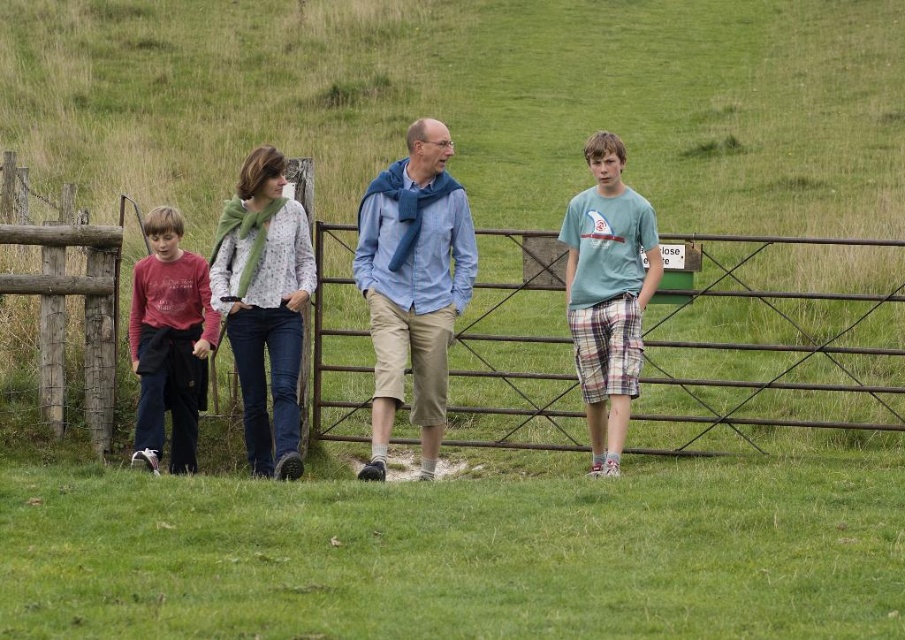
Can you confirm if light blue t-shirt at center is taller than matte red shirt at left?

Yes.

Does point (615, 179) lie behind point (181, 369)?

Yes, point (615, 179) is behind point (181, 369).

Between point (593, 317) and point (154, 218), which one is positioned behind?

Point (154, 218)

This screenshot has height=640, width=905. Find the location of `light blue t-shirt at center`. light blue t-shirt at center is located at coordinates (608, 292).

Can you confirm if rustic wood gate at center is thinner than matte red shirt at left?

Incorrect, rustic wood gate at center's width is not less than matte red shirt at left's.

Is point (568, 364) farther from camera compared to point (188, 324)?

Yes, it is behind point (188, 324).

This screenshot has width=905, height=640. I want to click on rustic wood gate at center, so click(x=774, y=344).

Does rustic wood gate at center have a greater height compared to blue cotton scarf at center?

Indeed, rustic wood gate at center has a greater height compared to blue cotton scarf at center.

Can you confirm if rustic wood gate at center is shorter than blue cotton scarf at center?

No.

Is point (845, 371) less distant than point (374, 406)?

No.

The height and width of the screenshot is (640, 905). What are the coordinates of `rustic wood gate at center` in the screenshot? It's located at (774, 344).